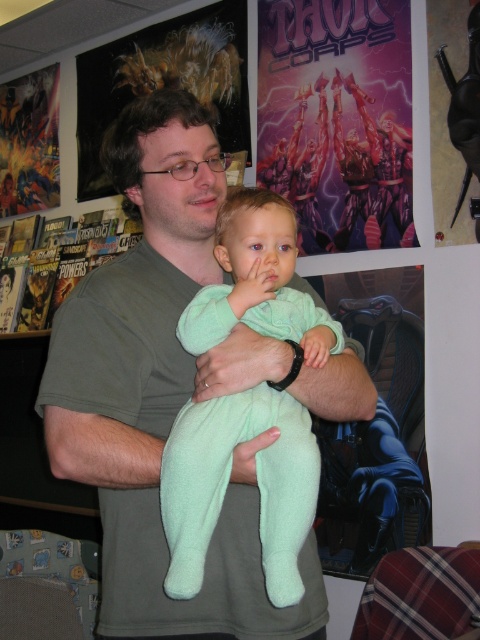
You are a fashion designer observing the scene. You need to determine which item is visible on top between the green fleece shirt at center and the mint fleece onesie at center. Which one is on top?

The green fleece shirt at center is positioned over the mint fleece onesie at center, so the green fleece shirt at center is visible on top.

You are an interior designer planning to hang two items in a child bedroom. You have the purple matte poster at upper center and the metallic silver figure at upper left. Based on the scene, which item is positioned to the right of the other?

The purple matte poster at upper center is positioned to the right of the metallic silver figure at upper left.

You are designing a layout for a nursery wall. The mint fleece onesie at center and the purple matte poster at upper center are both part of the design. Which object has a smaller width?

The mint fleece onesie at center has a smaller width than the purple matte poster at upper center.